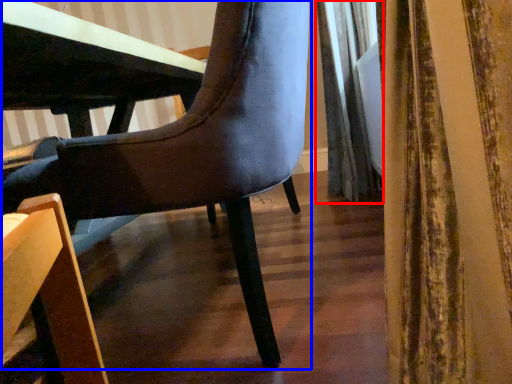
Question: Which point is closer to the camera, curtain (highlighted by a red box) or chair (highlighted by a blue box)?

Choices:
 (A) curtain
 (B) chair

Answer: (B)